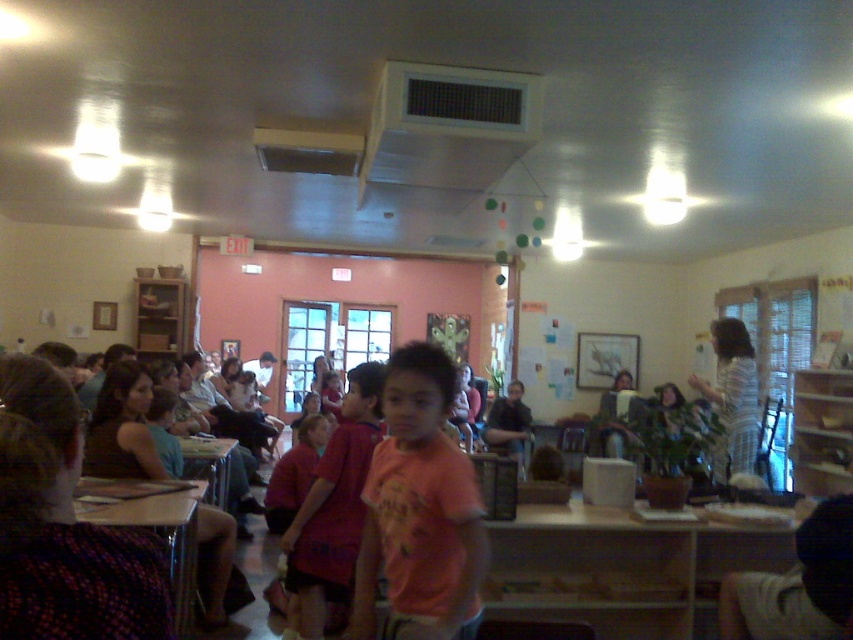
You are a photographer setting up for a group photo in the classroom. You notice the pink fabric shirt at center and the striped shirt at right. Which of these two shirts has a smaller width? Please answer based on their positions and the given information.

The pink fabric shirt at center has a smaller width than the striped shirt at right.

You are standing at the entrance of the classroom and want to locate the wooden desk at lower left. Based on its coordinates, which corner of the room is it closest to?

The wooden desk at lower left is closest to the lower left corner of the room since its coordinates are at point (155, 529), which places it near the lower left area.